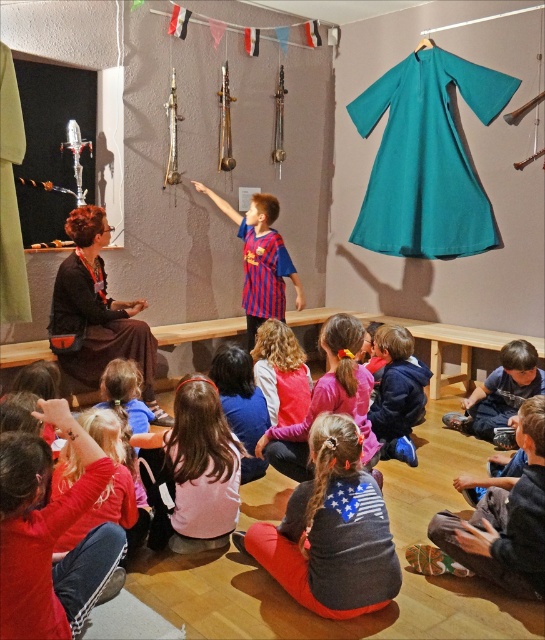
Question: Which of the following is the closest to the observer?

Choices:
 (A) matte pink shirt at center
 (B) blue cotton shirt at lower right
 (C) striped jersey at center

Answer: (A)

Question: From the image, what is the correct spatial relationship of gray cotton shirt at lower center in relation to blue cotton shirt at lower right?

Choices:
 (A) above
 (B) below

Answer: (B)

Question: Which point is farther from the camera taking this photo?

Choices:
 (A) (81, 264)
 (B) (432, 518)

Answer: (A)

Question: Observing the image, what is the correct spatial positioning of matte teal fabric dress at upper center in reference to matte pink shirt at center?

Choices:
 (A) above
 (B) below

Answer: (A)

Question: Which object is the closest to the matte pink shirt at center?

Choices:
 (A) gray cotton shirt at lower center
 (B) matte red shirt at lower left
 (C) matte brown dress at left
 (D) striped jersey at center

Answer: (A)

Question: Can you confirm if gray cotton shirt at lower center is positioned to the left of blue cotton shirt at lower right?

Choices:
 (A) yes
 (B) no

Answer: (A)